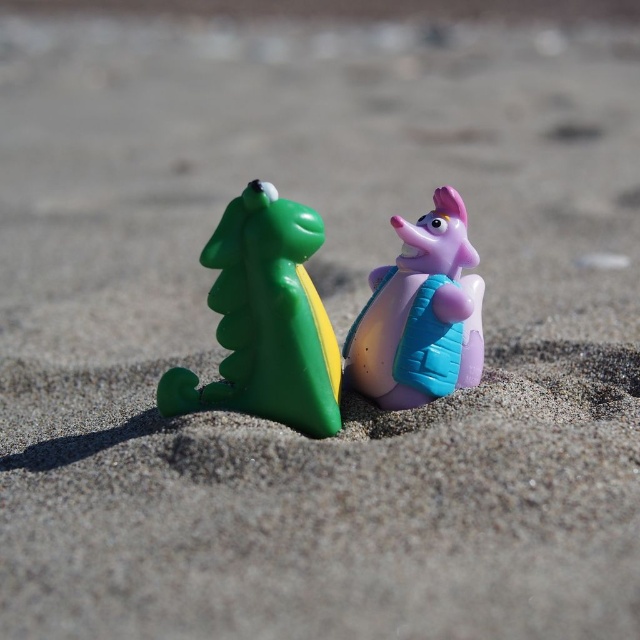
You are a child playing on the beach and want to place a seashell between the green plastic dinosaur at left and the glossy plastic snail at center. Based on their positions, where should you place the seashell to ensure it is between them?

The seashell should be placed between the green plastic dinosaur at left and the glossy plastic snail at center, closer to the glossy plastic snail at center since the green plastic dinosaur at left is in front of it.

You are holding a camera and want to take a photo of the point at coordinates point (228, 378). The camera is currently 39.17 inches away from the point. If the camera needs to be exactly 40 inches away to focus properly, should you move closer or farther away?

The camera is currently 39.17 inches away from point (228, 378), which is slightly closer than the required 40 inches. To focus properly, you should move the camera slightly farther away from the point.

You are a child playing on the beach and want to place both the green plastic dinosaur at left and the glossy plastic snail at center into your toy box. If the toy box can only hold one of them due to size, which toy should you choose to fit inside?

The glossy plastic snail at center is smaller in size than the green plastic dinosaur at left, so you should choose the glossy plastic snail at center to fit inside the toy box.